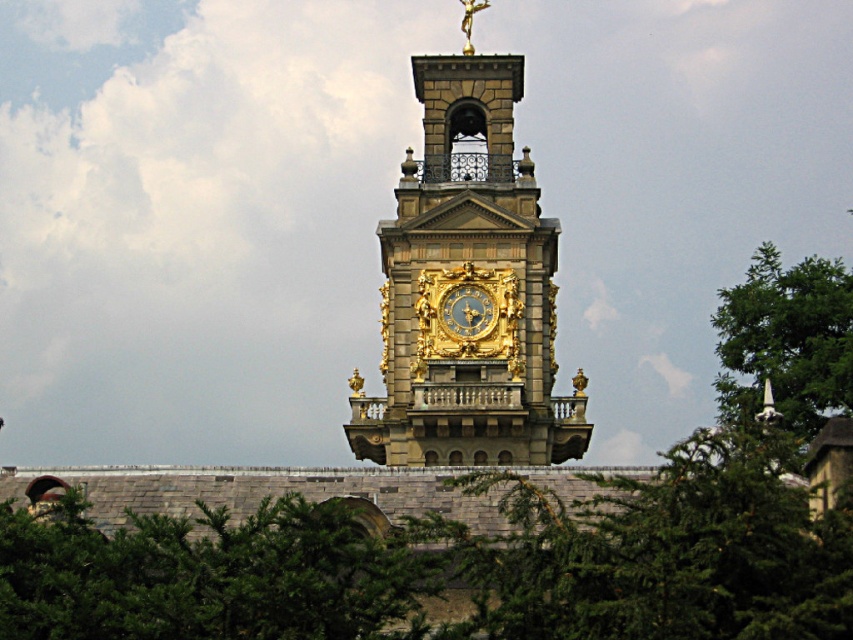
Looking at this image, you are an architect designing a new building and want to ensure that the gold ornate clock tower at center and the gold ornate clock at center are proportionate. Based on the scene, which one is taller?

The gold ornate clock tower at center is taller than the gold ornate clock at center.

You are an architect analyzing the layout of the gold ornate clock tower at center and the green leafy tree at right. Based on their positions, which object is closer to the left edge of the image?

The gold ornate clock tower at center is positioned on the left side of green leafy tree at right, so it is closer to the left edge of the image.

You are standing in front of the clock tower and notice two points marked on the tower. The first point is at coordinates point (778, 397) and the second is at point (465, 305). Which of these points is closer to you?

Point (778, 397) is closer to the viewer than point (465, 305).